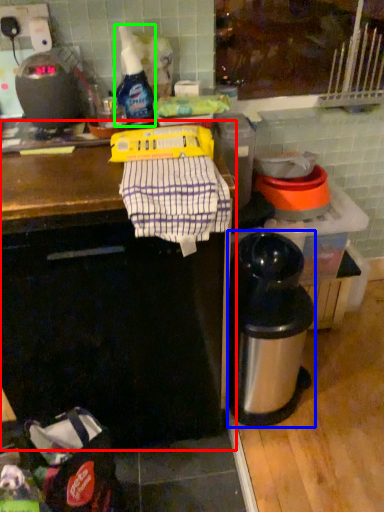
Question: Which object is positioned closest to counter (highlighted by a red box)? Select from appliance (highlighted by a blue box) and bottle (highlighted by a green box).

Choices:
 (A) appliance
 (B) bottle

Answer: (A)